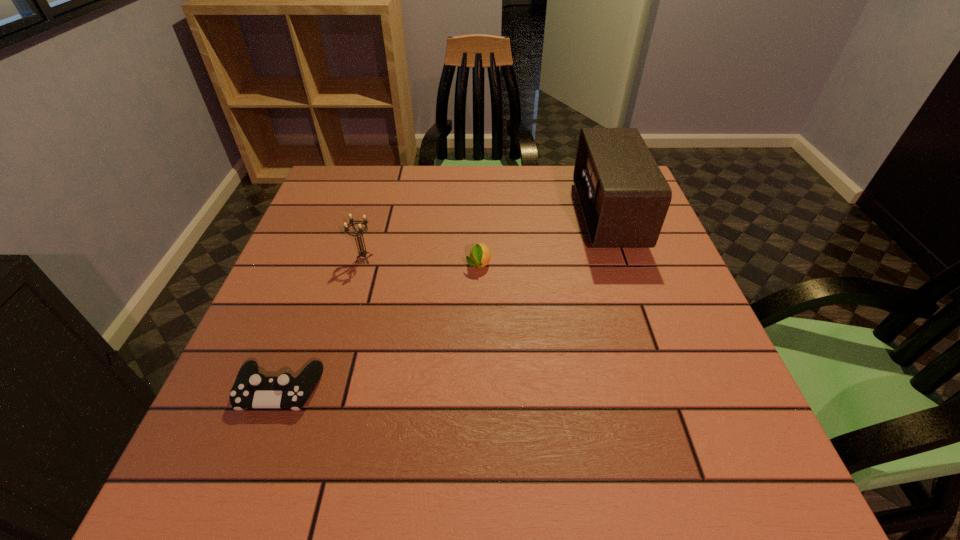
In the image, there is a desktop. Identify the location of vacant area at the far left corner. The width and height of the screenshot is (960, 540). (348, 181).

Where is `vacant space at the near left corner`? The image size is (960, 540). vacant space at the near left corner is located at coordinates coord(184,482).

Where is `unoccupied position between the second object from right to left and the candle holder`? The image size is (960, 540). unoccupied position between the second object from right to left and the candle holder is located at coordinates (421, 261).

Where is `free space between the radio receiver and the lemon`? free space between the radio receiver and the lemon is located at coordinates (543, 240).

The image size is (960, 540). Find the location of `vacant point located between the lemon and the control`. vacant point located between the lemon and the control is located at coordinates (379, 327).

The image size is (960, 540). What are the coordinates of `empty space that is in between the candle holder and the rightmost object` in the screenshot? It's located at (486, 237).

Where is `free space between the control and the radio receiver`? The image size is (960, 540). free space between the control and the radio receiver is located at coordinates (444, 303).

You are a GUI agent. You are given a task and a screenshot of the screen. Output one action in this format:
    pyautogui.click(x=<x>, y=<y>)
    Task: Click on the unoccupied area between the second object from right to left and the nearest object
    
    Given the screenshot: What is the action you would take?
    pyautogui.click(x=379, y=327)

Where is `unoccupied position between the lemon and the candle holder`? unoccupied position between the lemon and the candle holder is located at coordinates pos(421,261).

Locate an element on the screen. vacant region between the control and the third shortest object is located at coordinates (322, 325).